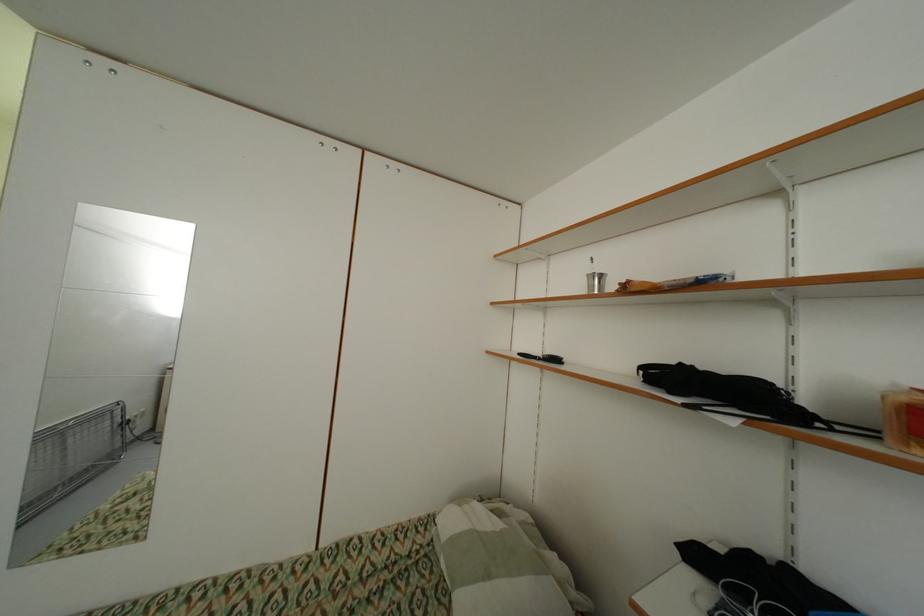
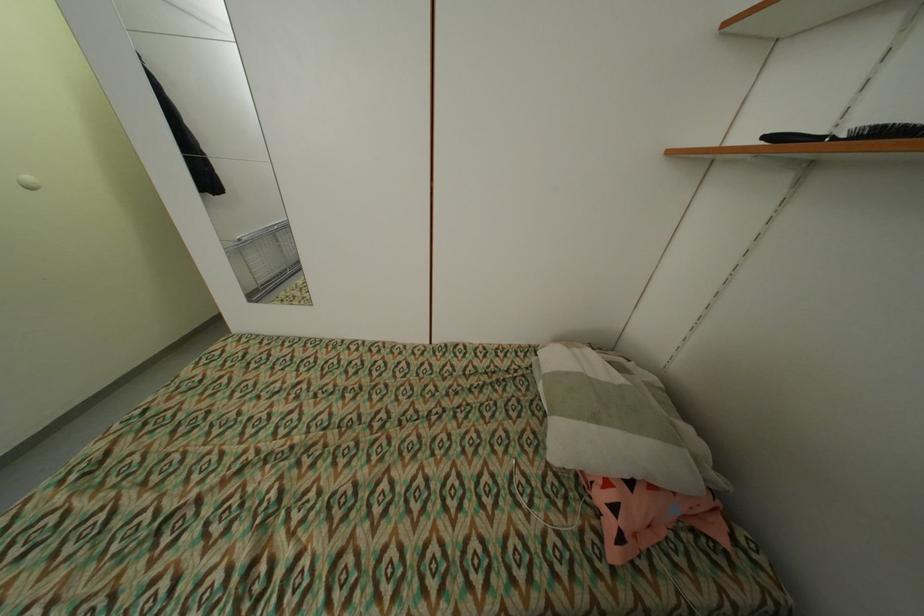
Based on the continuous images, in which direction is the camera rotating?

The camera rotated toward left-down.